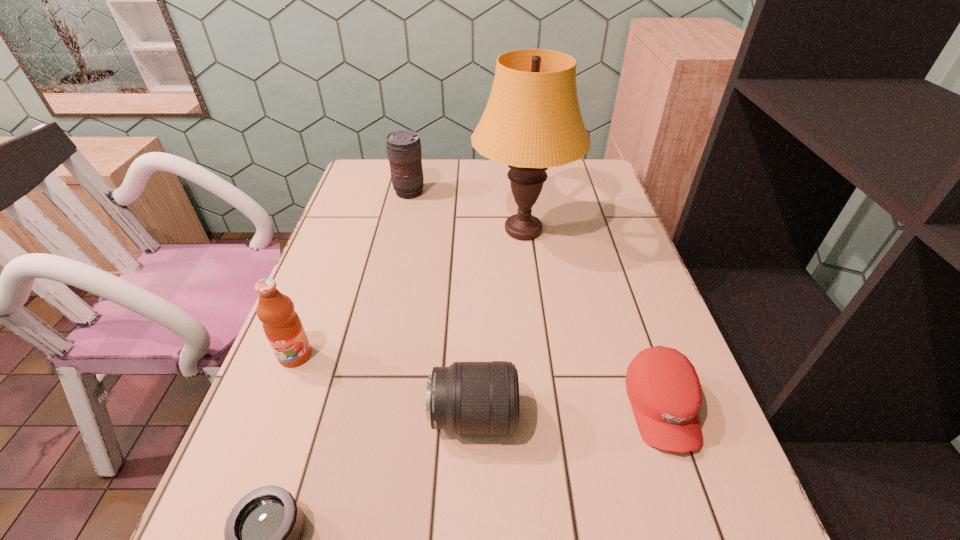
Find the location of a particular element. Image resolution: width=960 pixels, height=540 pixels. vacant region between the rightmost telephoto lens and the cap is located at coordinates (567, 412).

Where is `object that is the second closest to the fruit juice`? The width and height of the screenshot is (960, 540). object that is the second closest to the fruit juice is located at coordinates (468, 398).

Locate an element on the screen. object that is the second closest one to the cap is located at coordinates (532, 121).

Where is `telephoto lens that stands as the third closest to the cap`? The width and height of the screenshot is (960, 540). telephoto lens that stands as the third closest to the cap is located at coordinates coord(404,152).

Identify the location of telephoto lens object that ranks as the closest to the farthest object. (468, 398).

This screenshot has width=960, height=540. I want to click on vacant area in the image that satisfies the following two spatial constraints: 1. on the front-facing side of the fifth tallest object; 2. on the surface of the second nearest telephoto lens, so click(x=664, y=417).

You are a GUI agent. You are given a task and a screenshot of the screen. Output one action in this format:
    pyautogui.click(x=<x>, y=<y>)
    Task: Click on the blank area in the image that satisfies the following two spatial constraints: 1. on the front-facing side of the fifth tallest object; 2. on the surface of the fourth tallest object
    This screenshot has height=540, width=960.
    Given the screenshot: What is the action you would take?
    pyautogui.click(x=664, y=417)